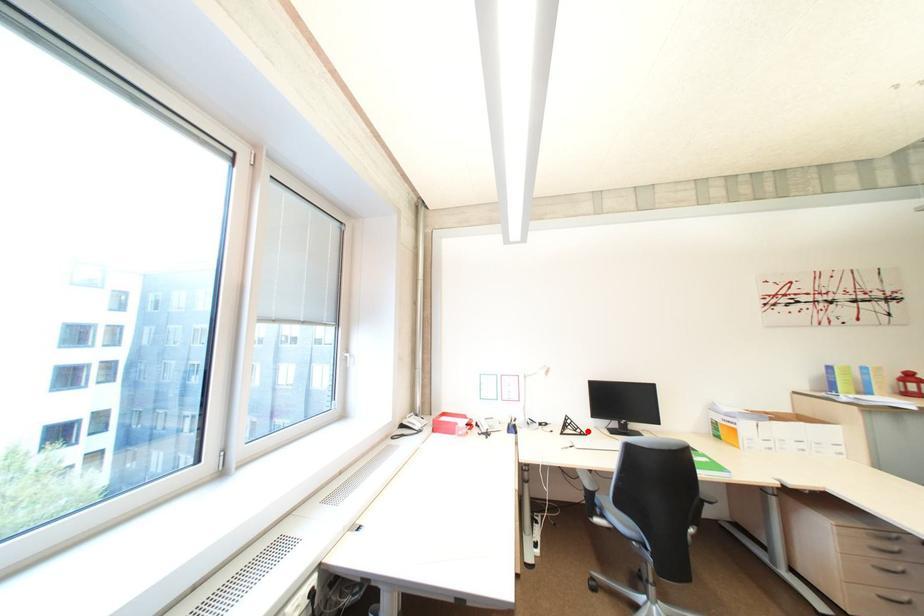
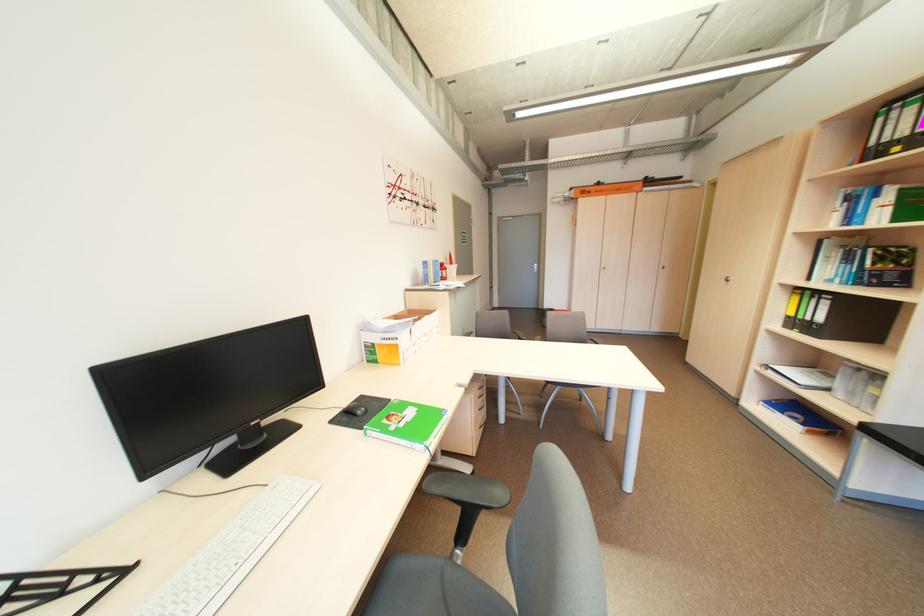
Question: I am providing you with two images of the same scene from different viewpoints. A red point is shown in image1. For the corresponding object point in image2, is it positioned nearer or farther from the camera?

Choices:
 (A) Nearer
 (B) Farther

Answer: (A)